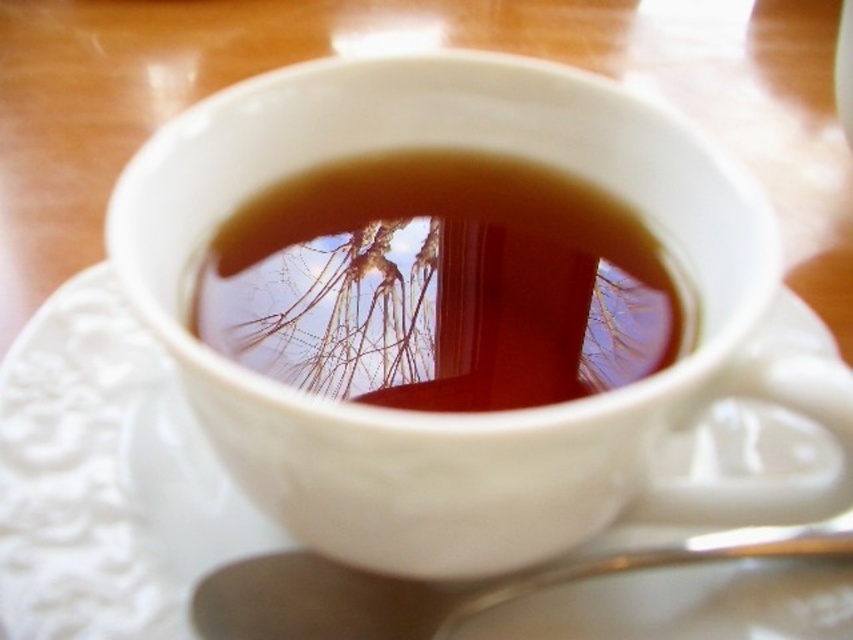
Question: Does brown glossy liquid at center come in front of silver metallic spoon at lower center?

Choices:
 (A) no
 (B) yes

Answer: (B)

Question: Does brown glossy liquid at center lie in front of silver metallic spoon at lower center?

Choices:
 (A) yes
 (B) no

Answer: (A)

Question: Which object is closer to the camera taking this photo?

Choices:
 (A) brown glossy liquid at center
 (B) white textured saucer at center
 (C) silver metallic spoon at lower center

Answer: (A)

Question: Which point is farther to the camera?

Choices:
 (A) brown glossy liquid at center
 (B) silver metallic spoon at lower center

Answer: (B)

Question: In this image, where is white textured saucer at center located relative to brown glossy liquid at center?

Choices:
 (A) below
 (B) above

Answer: (A)

Question: Which point is closer to the camera?

Choices:
 (A) (833, 552)
 (B) (260, 339)
 (C) (355, 608)

Answer: (B)